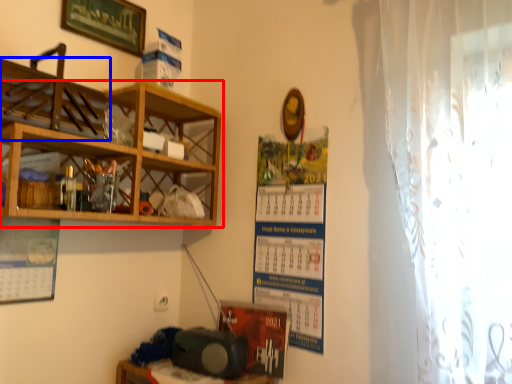
Question: Which object appears closest to the camera in this image, shelf (highlighted by a red box) or shelf (highlighted by a blue box)?

Choices:
 (A) shelf
 (B) shelf

Answer: (B)